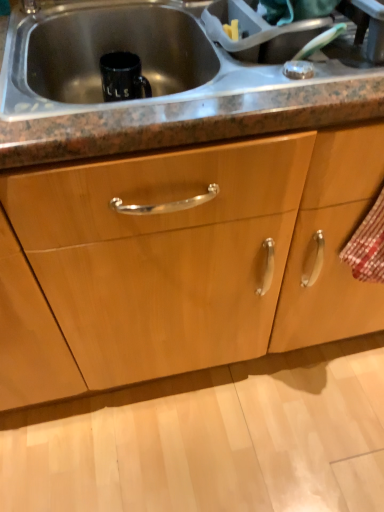
The width and height of the screenshot is (384, 512). Describe the element at coordinates (189, 106) in the screenshot. I see `granite gray countertop at center` at that location.

Locate an element on the screen. Image resolution: width=384 pixels, height=512 pixels. granite gray countertop at center is located at coordinates (189, 106).

Locate an element on the screen. This screenshot has width=384, height=512. granite gray countertop at center is located at coordinates (189, 106).